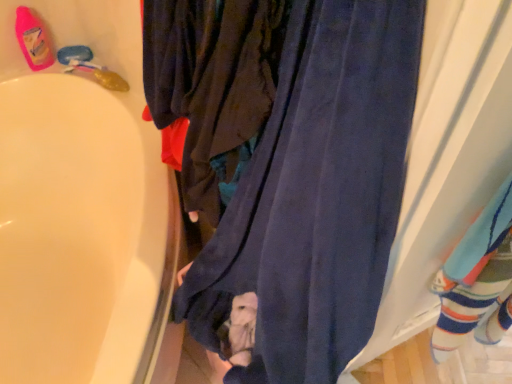
Question: Considering the positions of pink plastic bottle at upper left and navy blue fabric at center in the image, is pink plastic bottle at upper left bigger or smaller than navy blue fabric at center?

Choices:
 (A) big
 (B) small

Answer: (B)

Question: Is pink plastic bottle at upper left wider or thinner than navy blue fabric at center?

Choices:
 (A) wide
 (B) thin

Answer: (B)

Question: Based on their relative distances, which object is nearer to the striped cotton socks at right?

Choices:
 (A) velvet-like dark blue pants at center
 (B) navy blue fabric at center
 (C) pink plastic bottle at upper left

Answer: (B)

Question: Which is nearer to the velvet-like dark blue pants at center?

Choices:
 (A) pink plastic bottle at upper left
 (B) navy blue fabric at center
 (C) striped cotton socks at right

Answer: (B)